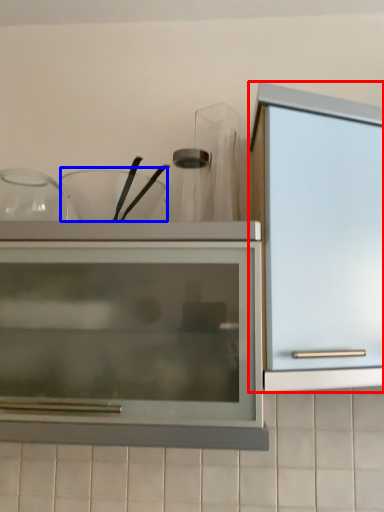
Question: Which of the following is the closest to the observer, cabinetry (highlighted by a red box) or tableware (highlighted by a blue box)?

Choices:
 (A) cabinetry
 (B) tableware

Answer: (A)